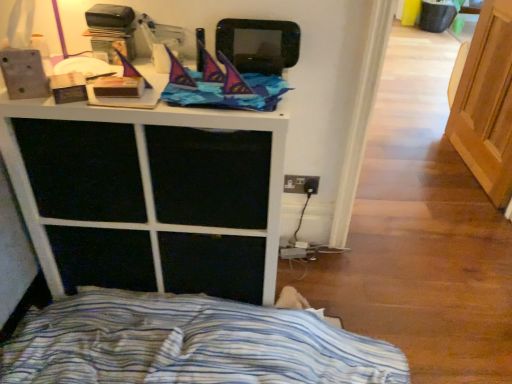
Question: Is blue striped fabric at lower left far away from light brown wood screen door at right?

Choices:
 (A) yes
 (B) no

Answer: (A)

Question: Considering the relative positions of blue striped fabric at lower left and light brown wood screen door at right in the image provided, is blue striped fabric at lower left to the left of light brown wood screen door at right from the viewer's perspective?

Choices:
 (A) yes
 (B) no

Answer: (A)

Question: From the image's perspective, is blue striped fabric at lower left under light brown wood screen door at right?

Choices:
 (A) no
 (B) yes

Answer: (B)

Question: Considering the relative sizes of blue striped fabric at lower left and light brown wood screen door at right in the image provided, is blue striped fabric at lower left smaller than light brown wood screen door at right?

Choices:
 (A) no
 (B) yes

Answer: (A)

Question: Is blue striped fabric at lower left positioned beyond the bounds of light brown wood screen door at right?

Choices:
 (A) no
 (B) yes

Answer: (B)

Question: Is blue striped fabric at lower left turned away from light brown wood screen door at right?

Choices:
 (A) yes
 (B) no

Answer: (B)

Question: Considering the relative positions of white matte cabinet at upper center and blue striped fabric at lower left in the image provided, is white matte cabinet at upper center to the right of blue striped fabric at lower left from the viewer's perspective?

Choices:
 (A) no
 (B) yes

Answer: (A)

Question: Are white matte cabinet at upper center and blue striped fabric at lower left far apart?

Choices:
 (A) yes
 (B) no

Answer: (B)

Question: Is white matte cabinet at upper center next to blue striped fabric at lower left and touching it?

Choices:
 (A) yes
 (B) no

Answer: (B)

Question: Is white matte cabinet at upper center facing away from blue striped fabric at lower left?

Choices:
 (A) no
 (B) yes

Answer: (A)

Question: Is white matte cabinet at upper center oriented towards blue striped fabric at lower left?

Choices:
 (A) no
 (B) yes

Answer: (B)

Question: From a real-world perspective, is white matte cabinet at upper center on top of blue striped fabric at lower left?

Choices:
 (A) no
 (B) yes

Answer: (B)

Question: Is blue striped fabric at lower left far away from white matte cabinet at upper center?

Choices:
 (A) yes
 (B) no

Answer: (B)